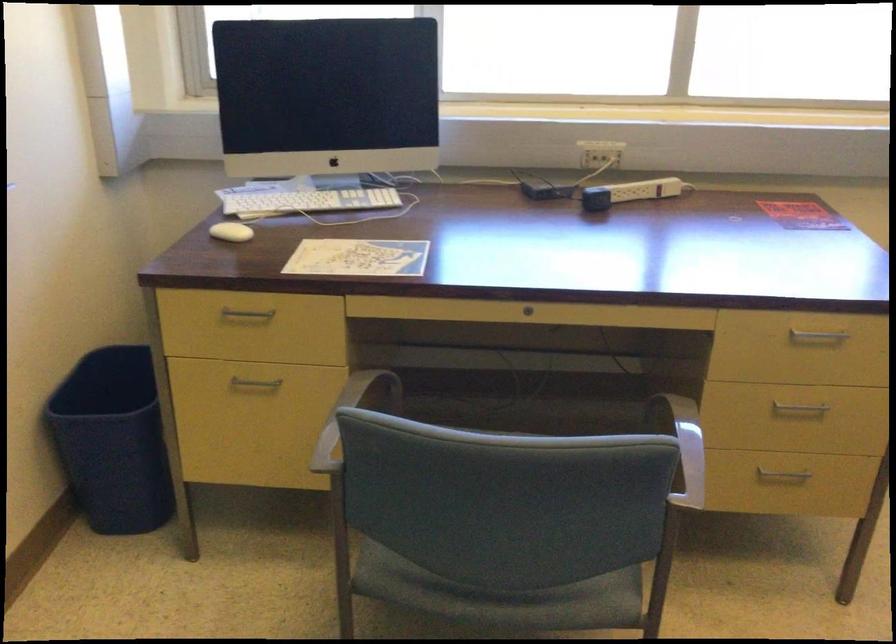
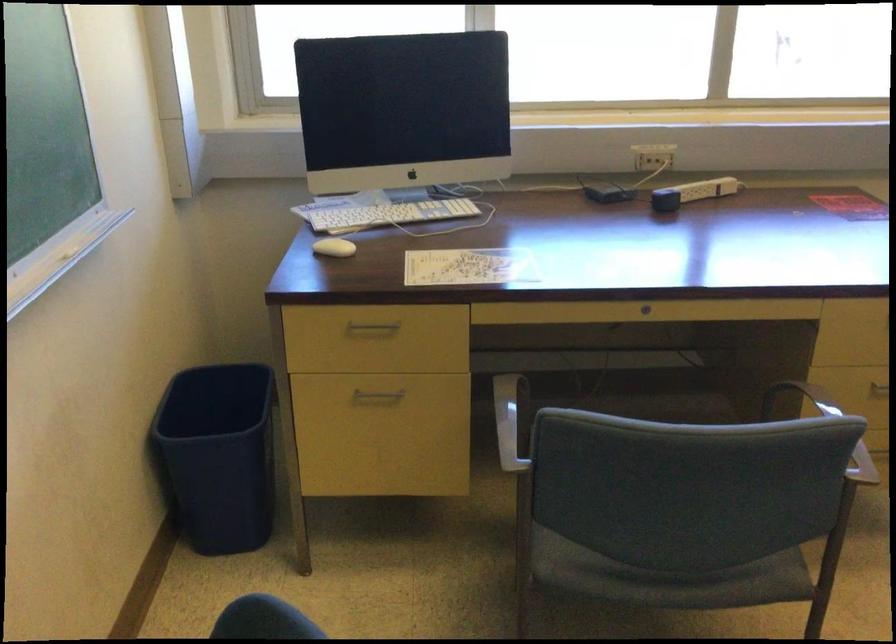
In the second image, find the point that corresponds to point (251, 317) in the first image.

(373, 327)